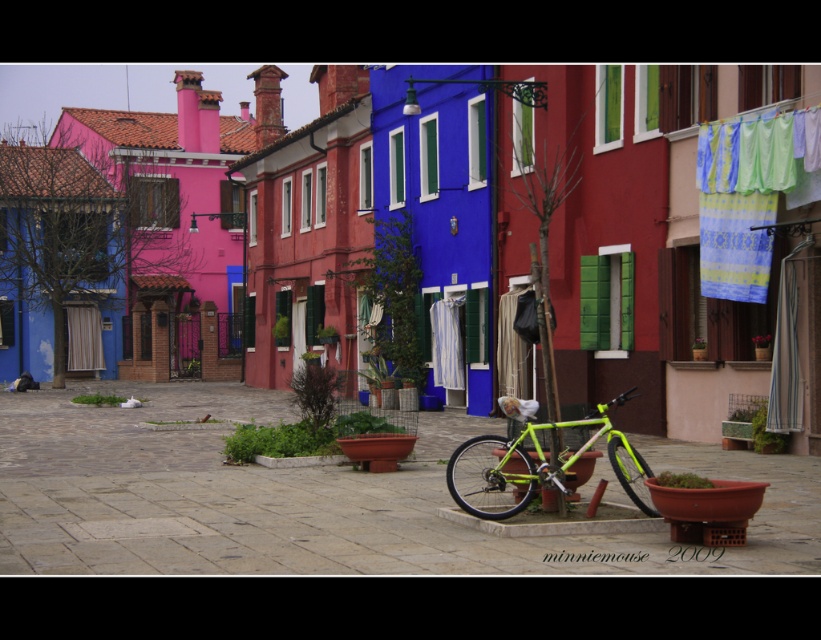
You are a tourist in Burano, Italy, and you spot a blue striped fabric at upper right and a neon green frame at center. Which object is higher up in the image?

The blue striped fabric at upper right is positioned over the neon green frame at center, meaning it is higher up in the image.

You are a tourist in Burano, Italy, and you see a neon green bicycle at center and a neon green frame at center. Which one is positioned to the left?

The neon green bicycle at center is positioned to the left of the neon green frame at center.

You are standing in the square and want to find the neon green bicycle at center. According to the coordinates provided, where should you look?

The neon green bicycle at center is located at coordinates point (317, 499).